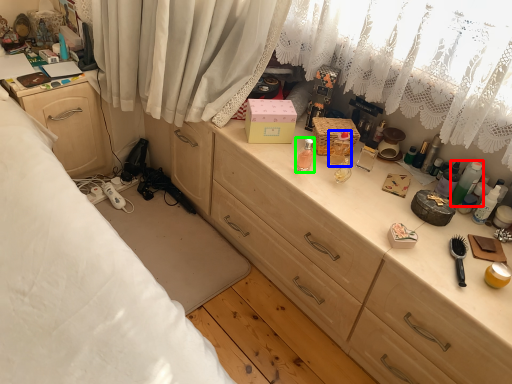
Question: Considering the real-world distances, which object is closest to toiletry (highlighted by a red box)? toiletry (highlighted by a blue box) or toiletry (highlighted by a green box).

Choices:
 (A) toiletry
 (B) toiletry

Answer: (A)